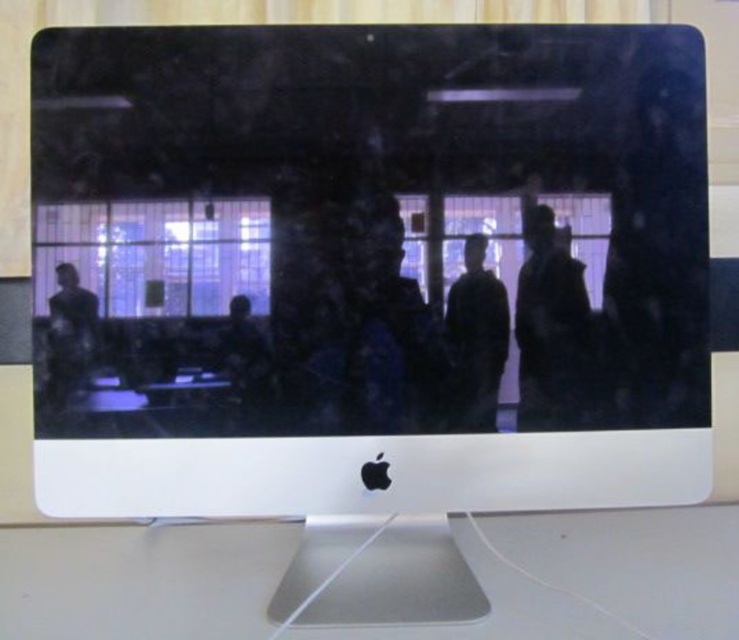
Question: Can you confirm if dark fabric jacket at right is bigger than matte black jacket at left?

Choices:
 (A) no
 (B) yes

Answer: (B)

Question: Which object is the closest to the silver metallic computer desk at center?

Choices:
 (A) dark fabric jacket at right
 (B) matte black jacket at left

Answer: (A)

Question: Which point is farther to the camera?

Choices:
 (A) (463, 403)
 (B) (98, 605)

Answer: (A)

Question: Can you confirm if silver metallic computer desk at center is positioned to the right of dark fabric jacket at right?

Choices:
 (A) no
 (B) yes

Answer: (A)

Question: Among these objects, which one is farthest from the camera?

Choices:
 (A) silver metallic computer desk at center
 (B) matte black jacket at left
 (C) black matte jacket at center

Answer: (C)

Question: Does silver metallic computer desk at center lie behind matte black jacket at left?

Choices:
 (A) no
 (B) yes

Answer: (A)